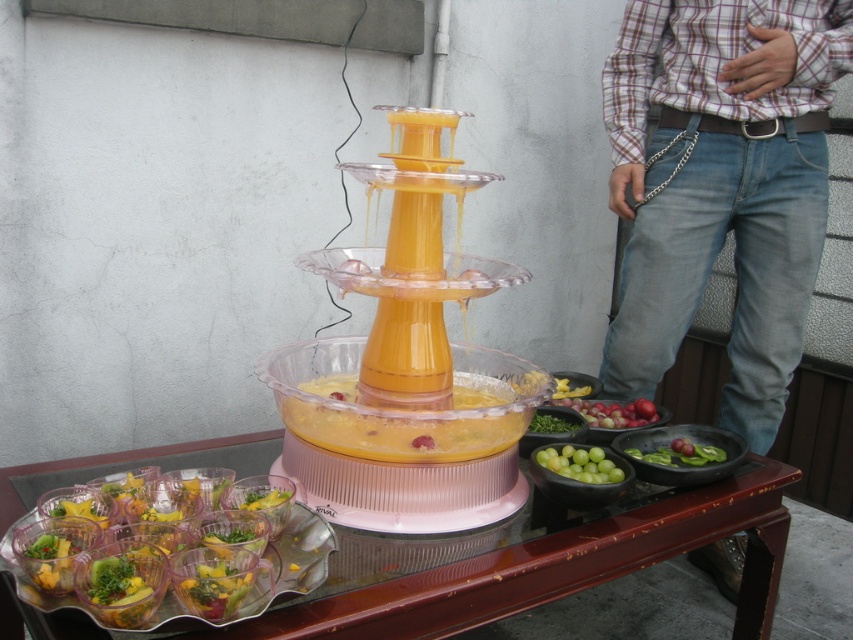
Between denim jeans at right and green matte grapes at lower center, which one is positioned lower?

green matte grapes at lower center

Based on the photo, between denim jeans at right and green matte grapes at lower center, which one has less height?

green matte grapes at lower center is shorter.

Locate an element on the screen. denim jeans at right is located at coordinates (720, 186).

Between denim jeans at right and green leafy vegetables at center, which one has more height?

With more height is denim jeans at right.

Between denim jeans at right and green leafy vegetables at center, which one appears on the left side from the viewer's perspective?

From the viewer's perspective, green leafy vegetables at center appears more on the left side.

You are a GUI agent. You are given a task and a screenshot of the screen. Output one action in this format:
    pyautogui.click(x=<x>, y=<y>)
    Task: Click on the denim jeans at right
    The width and height of the screenshot is (853, 640).
    Given the screenshot: What is the action you would take?
    pyautogui.click(x=720, y=186)

Can you confirm if clear plastic tray at lower center is positioned below green matte kiwi slices at lower right?

Yes.

Locate an element on the screen. clear plastic tray at lower center is located at coordinates (554, 564).

Who is more forward, (733, 509) or (657, 449)?

Point (733, 509)

Image resolution: width=853 pixels, height=640 pixels. I want to click on clear plastic tray at lower center, so click(x=554, y=564).